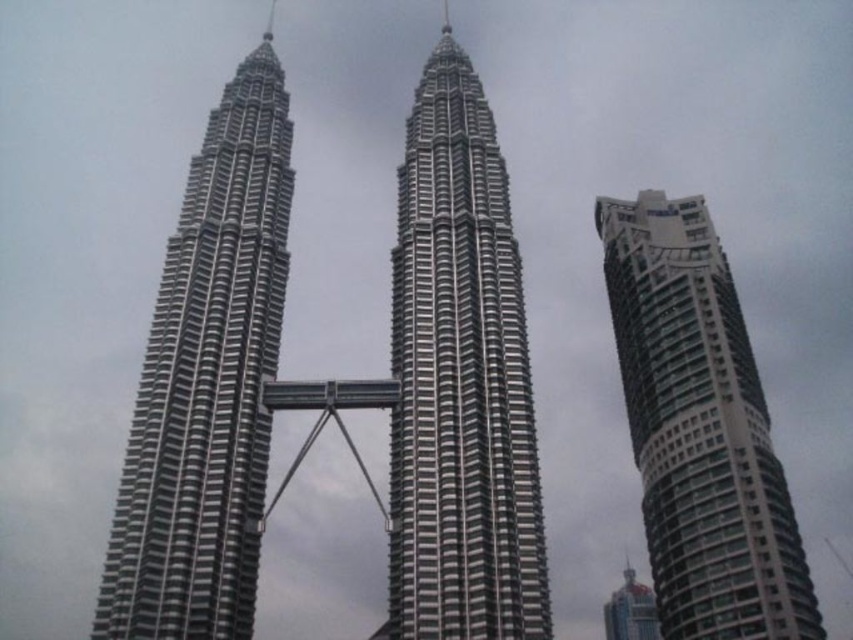
Is silver metallic twin towers at center taller than shiny blue glass skyscraper at lower right?

Yes.

I want to click on silver metallic twin towers at center, so [x=207, y=381].

Measure the distance between silver metallic building at center and camera.

silver metallic building at center and camera are 61.47 meters apart from each other.

Which is below, silver metallic building at center or silver metallic twin towers at center?

Positioned lower is silver metallic building at center.

The height and width of the screenshot is (640, 853). Identify the location of silver metallic building at center. (460, 380).

Who is positioned more to the left, silver metallic building at center or shiny blue glass skyscraper at lower right?

silver metallic building at center

Identify the location of silver metallic building at center. (460, 380).